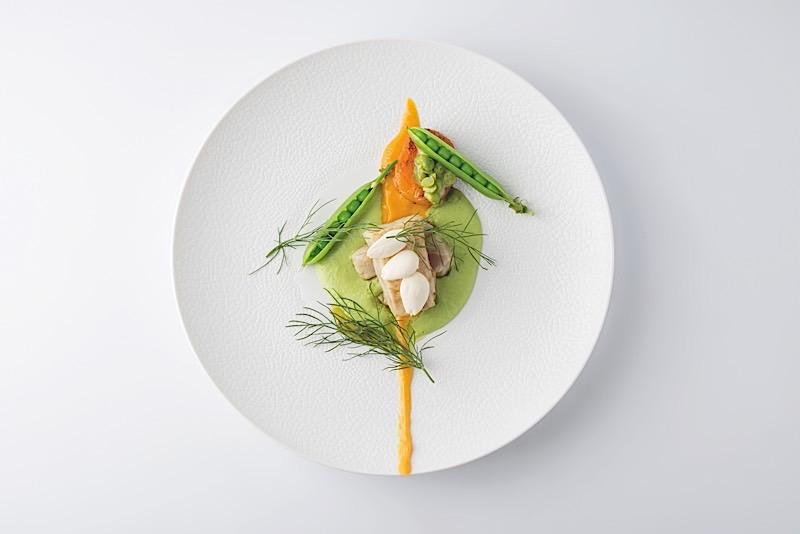
You are a GUI agent. You are given a task and a screenshot of the screen. Output one action in this format:
    pyautogui.click(x=<x>, y=<y>)
    Task: Click on the plate
    Image resolution: width=800 pixels, height=534 pixels.
    Given the screenshot: What is the action you would take?
    pyautogui.click(x=550, y=328)